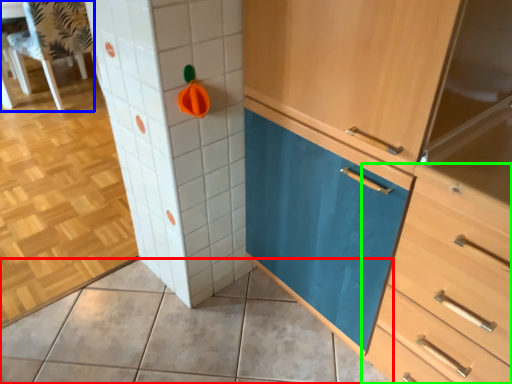
Question: Which object is the closest to the ceramic tile (highlighted by a red box)? Choose among these: chair (highlighted by a blue box) or chest of drawers (highlighted by a green box).

Choices:
 (A) chair
 (B) chest of drawers

Answer: (B)